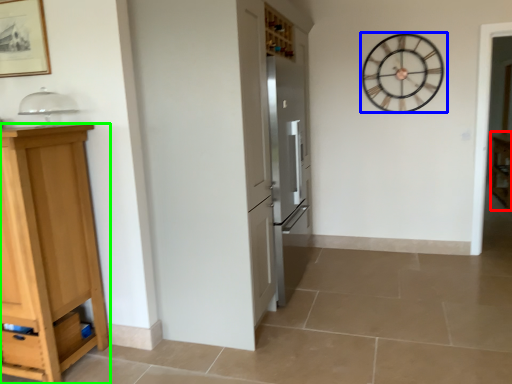
Question: Which object is the farthest from cabinetry (highlighted by a red box)? Choose among these: wall clock (highlighted by a blue box) or cabinetry (highlighted by a green box).

Choices:
 (A) wall clock
 (B) cabinetry

Answer: (B)